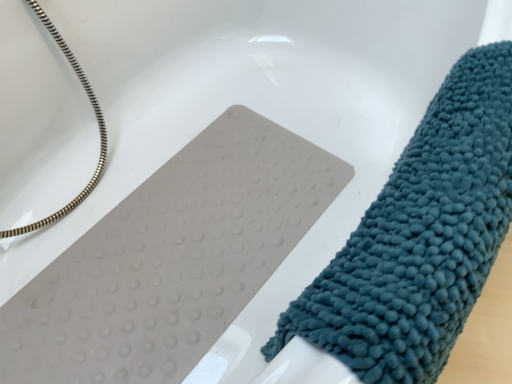
Question: Does silver metallic hose at upper left have a larger size compared to teal textured towel at right?

Choices:
 (A) yes
 (B) no

Answer: (A)

Question: Considering the relative sizes of silver metallic hose at upper left and teal textured towel at right in the image provided, is silver metallic hose at upper left thinner than teal textured towel at right?

Choices:
 (A) no
 (B) yes

Answer: (A)

Question: Does silver metallic hose at upper left have a lesser height compared to teal textured towel at right?

Choices:
 (A) yes
 (B) no

Answer: (B)

Question: Considering the relative sizes of silver metallic hose at upper left and teal textured towel at right in the image provided, is silver metallic hose at upper left taller than teal textured towel at right?

Choices:
 (A) yes
 (B) no

Answer: (A)

Question: Is silver metallic hose at upper left at the left side of teal textured towel at right?

Choices:
 (A) yes
 (B) no

Answer: (A)

Question: Is silver metallic hose at upper left facing away from teal textured towel at right?

Choices:
 (A) yes
 (B) no

Answer: (B)

Question: Can you confirm if teal textured towel at right is positioned to the left of silver metallic hose at upper left?

Choices:
 (A) yes
 (B) no

Answer: (B)

Question: From the image's perspective, is teal textured towel at right beneath silver metallic hose at upper left?

Choices:
 (A) no
 (B) yes

Answer: (B)

Question: Does teal textured towel at right have a larger size compared to silver metallic hose at upper left?

Choices:
 (A) no
 (B) yes

Answer: (A)

Question: Is teal textured towel at right closer to camera compared to silver metallic hose at upper left?

Choices:
 (A) no
 (B) yes

Answer: (B)

Question: Is teal textured towel at right further to camera compared to silver metallic hose at upper left?

Choices:
 (A) no
 (B) yes

Answer: (A)

Question: From a real-world perspective, is teal textured towel at right beneath silver metallic hose at upper left?

Choices:
 (A) yes
 (B) no

Answer: (B)

Question: Based on their sizes in the image, would you say teal textured towel at right is bigger or smaller than silver metallic hose at upper left?

Choices:
 (A) small
 (B) big

Answer: (A)